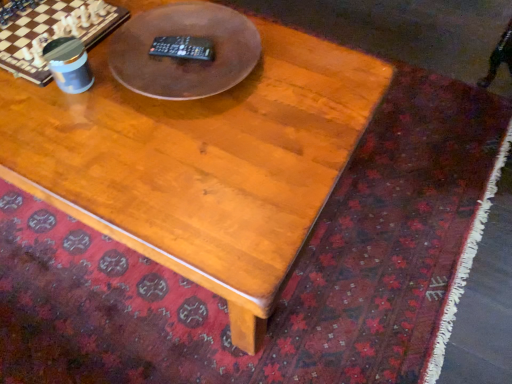
The image size is (512, 384). Find the location of `unoccupied region to the right of brown wooden table at center`. unoccupied region to the right of brown wooden table at center is located at coordinates (312, 88).